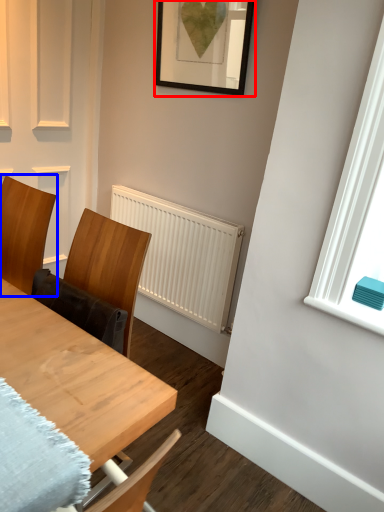
Question: Which of the following is the farthest to the observer, picture frame (highlighted by a red box) or chair (highlighted by a blue box)?

Choices:
 (A) picture frame
 (B) chair

Answer: (A)